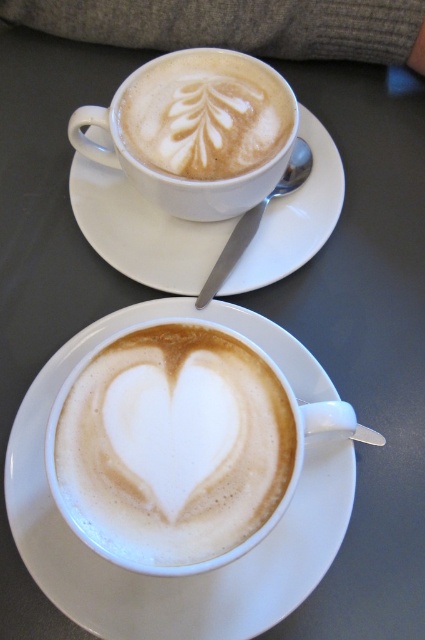
Is point (320, 477) positioned after point (158, 209)?

No, it is in front of (158, 209).

Can you confirm if white ceramic saucer at center is bigger than white ceramic saucer at upper center?

Indeed, white ceramic saucer at center has a larger size compared to white ceramic saucer at upper center.

Is point (354, 465) positioned in front of point (169, 282)?

Yes.

Where is `white ceramic saucer at center`? The width and height of the screenshot is (425, 640). white ceramic saucer at center is located at coordinates (187, 573).

What do you see at coordinates (141, 230) in the screenshot?
I see `white ceramic saucer at upper center` at bounding box center [141, 230].

Which is in front, point (320, 218) or point (122, 144)?

Point (122, 144) is more forward.

At what (x,y) coordinates should I click in order to perform the action: click on white ceramic saucer at upper center. Please return your answer as a coordinate pair (x, y). This screenshot has height=640, width=425. Looking at the image, I should click on (141, 230).

Can you confirm if white ceramic saucer at center is positioned to the left of latte art at upper center?

Indeed, white ceramic saucer at center is positioned on the left side of latte art at upper center.

Is white ceramic saucer at center to the right of latte art at upper center from the viewer's perspective?

No, white ceramic saucer at center is not to the right of latte art at upper center.

Is point (271, 541) positioned behind point (159, 97)?

No, (271, 541) is in front of (159, 97).

The height and width of the screenshot is (640, 425). In order to click on white ceramic saucer at center in this screenshot , I will do `click(187, 573)`.